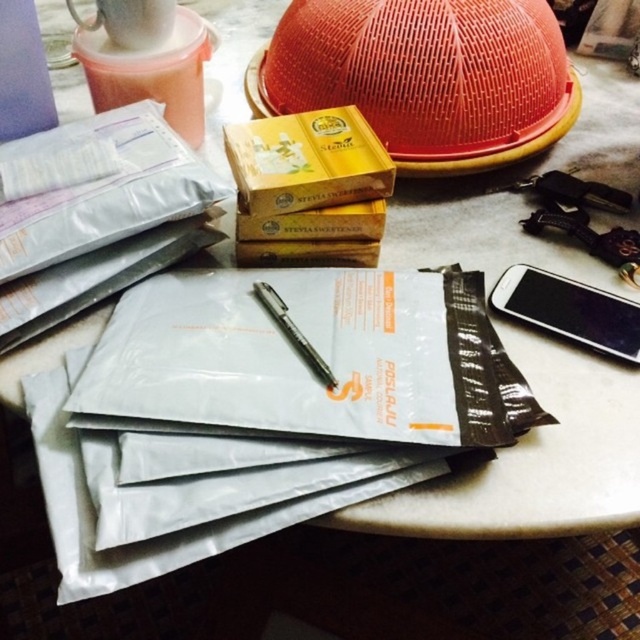
You are trying to take a photo of the point at coordinates (636, 337). The camera you are using has a minimum focus distance of 24 inches. Will the point be in focus?

The point at coordinates (636, 337) is 23.09 inches away from the camera, which is within the minimum focus distance of 24 inches. Therefore, the point will be in focus.

You are organizing items on a table and need to place the black glossy smartphone at right and the black metallic pen at center into a drawer. The drawer has a height limit of 10 cm. Can both items fit vertically without bending or damaging them?

The black glossy smartphone at right is taller than the black metallic pen at center. Since the drawer has a 10 cm height limit, if the smartphone exceeds 10 cm, it won mentioned in the description. However, based on typical smartphone and pen dimensions, the pen is likely shorter than 10 cm. But since the smartphone is taller than the pen, if the smartphone is over 10 cm, it won fit. However, without exact measurements, we cannot be certain. The description only states the smartphone is taller than the pen

You need to place a new item on the table between the black glossy smartphone at right and the black metallic pen at center. Which side of the smartphone should you place it on to ensure it is closer to the pen?

The black glossy smartphone at right is bigger than the black metallic pen at center. To place the new item closer to the pen, you should put it on the left side of the smartphone at right since the pen is located to the left of the smartphone.